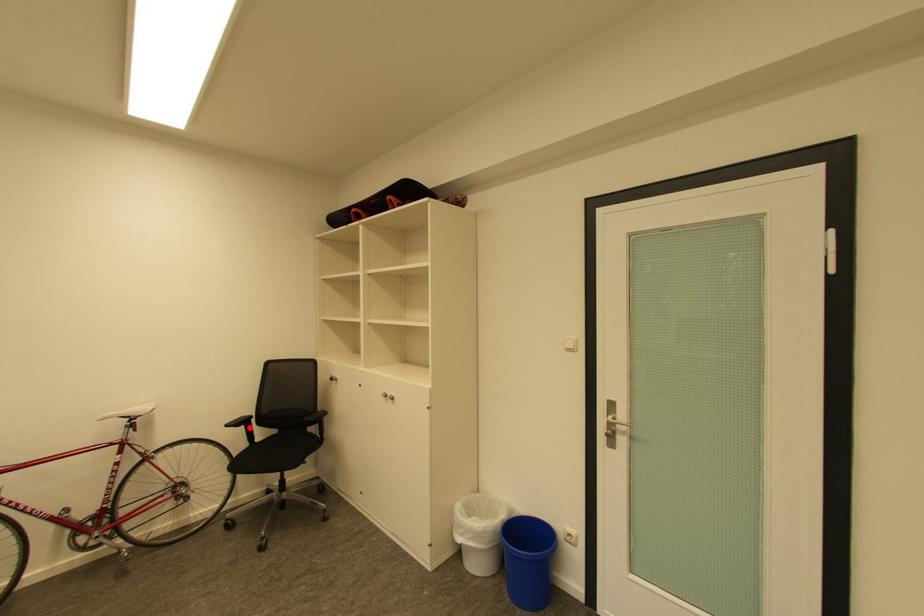
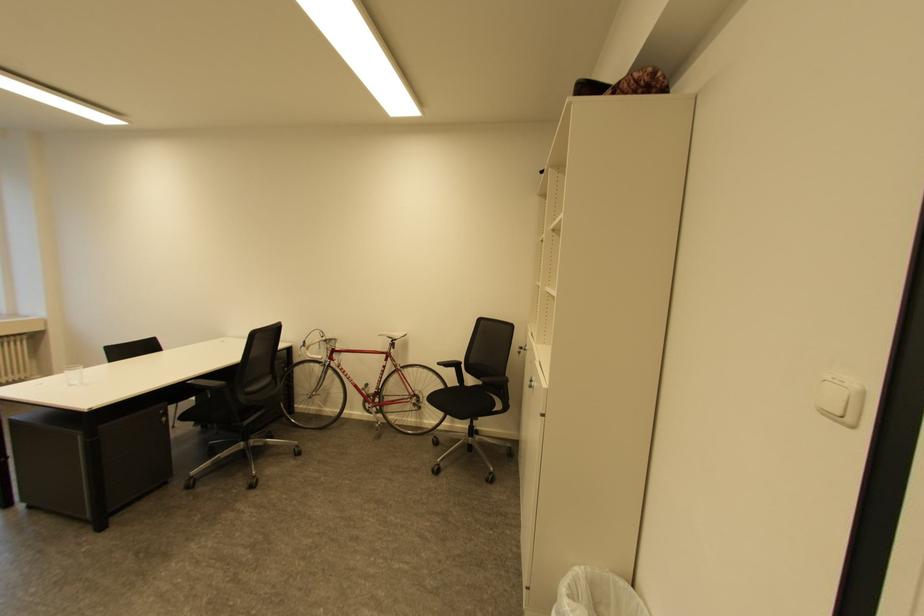
The point at the highlighted location is marked in the first image. Where is the corresponding point in the second image?

(459, 370)